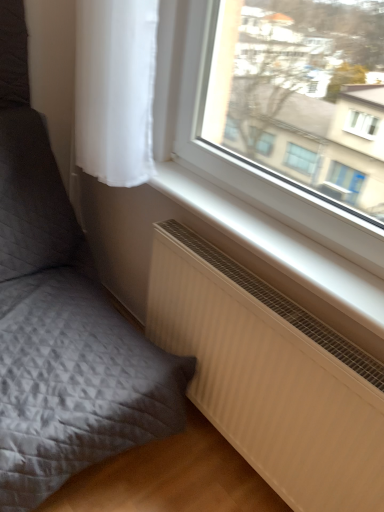
Question: In terms of size, does white matte window sill at lower center appear bigger or smaller than matte gray cushion at lower left?

Choices:
 (A) big
 (B) small

Answer: (B)

Question: Considering the positions of white matte window sill at lower center and matte gray cushion at lower left in the image, is white matte window sill at lower center wider or thinner than matte gray cushion at lower left?

Choices:
 (A) thin
 (B) wide

Answer: (A)

Question: Considering the real-world distances, which object is closest to the white ribbed radiator at lower right?

Choices:
 (A) white sheer curtain at upper left
 (B) matte gray cushion at lower left
 (C) white matte window sill at lower center

Answer: (C)

Question: Which object is the closest to the white sheer curtain at upper left?

Choices:
 (A) white matte window sill at lower center
 (B) matte gray cushion at lower left
 (C) white ribbed radiator at lower right

Answer: (A)